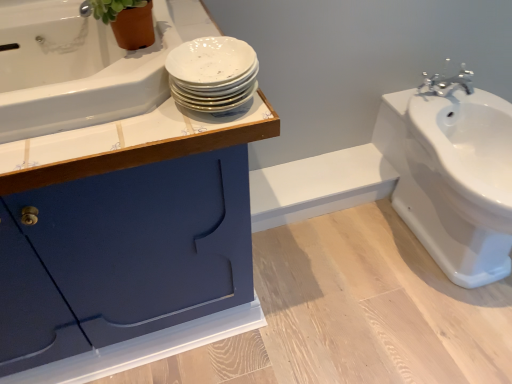
What is the approximate width of matte blue cabinet at upper left?

It is 56.89 centimeters.

This screenshot has width=512, height=384. Describe the element at coordinates (75, 70) in the screenshot. I see `white glossy bathtub at upper left` at that location.

The image size is (512, 384). I want to click on white glossy sink at right, so click(x=452, y=173).

The image size is (512, 384). What do you see at coordinates (213, 74) in the screenshot? I see `white glossy plates at upper center` at bounding box center [213, 74].

In order to face white glossy plates at upper center, should I rotate leftwards or rightwards?

Rotate your view left by about 5.677°.

The height and width of the screenshot is (384, 512). Find the location of `green matte plant at upper left`. green matte plant at upper left is located at coordinates (109, 8).

Which of these two, white glossy bathtub at upper left or white glossy sink at right, is bigger?

Bigger between the two is white glossy sink at right.

Considering the sizes of objects white glossy bathtub at upper left and white glossy sink at right in the image provided, who is wider, white glossy bathtub at upper left or white glossy sink at right?

white glossy sink at right.

Which is behind, point (32, 67) or point (440, 223)?

Point (440, 223)

Which is in front, point (178, 101) or point (384, 110)?

Positioned in front is point (178, 101).

Is white glossy plates at upper center smaller than white glossy sink at right?

Correct, white glossy plates at upper center occupies less space than white glossy sink at right.

Are white glossy plates at upper center and white glossy sink at right far apart?

No, white glossy plates at upper center is in close proximity to white glossy sink at right.

Is white glossy plates at upper center closer to camera compared to white glossy sink at right?

Yes.

From a real-world perspective, is white glossy bathtub at upper left above or below green matte plant at upper left?

white glossy bathtub at upper left is below green matte plant at upper left.

Consider the image. How many degrees apart are the facing directions of white glossy bathtub at upper left and green matte plant at upper left?

35.7 degrees.

Considering the sizes of objects white glossy bathtub at upper left and green matte plant at upper left in the image provided, who is thinner, white glossy bathtub at upper left or green matte plant at upper left?

green matte plant at upper left.

Is matte blue cabinet at upper left aimed at green matte plant at upper left?

No, matte blue cabinet at upper left is not turned towards green matte plant at upper left.

From a real-world perspective, which is physically above, matte blue cabinet at upper left or green matte plant at upper left?

green matte plant at upper left.

Is matte blue cabinet at upper left positioned in front of green matte plant at upper left?

Yes, it is in front of green matte plant at upper left.

Identify the location of bathroom cabinet below the green matte plant at upper left (from the image's perspective). Image resolution: width=512 pixels, height=384 pixels. (126, 242).

Which of these two, white glossy sink at right or green matte plant at upper left, stands taller?

white glossy sink at right is taller.

From the image's perspective, which object appears higher, white glossy sink at right or green matte plant at upper left?

green matte plant at upper left appears higher in the image.

Is white glossy sink at right positioned beyond the bounds of green matte plant at upper left?

Absolutely, white glossy sink at right is external to green matte plant at upper left.

In the scene shown: Does white glossy sink at right appear on the left side of green matte plant at upper left?

In fact, white glossy sink at right is to the right of green matte plant at upper left.

Does green matte plant at upper left have a lesser height compared to white glossy plates at upper center?

In fact, green matte plant at upper left may be taller than white glossy plates at upper center.

Can you tell me how much green matte plant at upper left and white glossy plates at upper center differ in facing direction?

They differ by 34.5 degrees in their facing directions.

Based on the photo, would you say green matte plant at upper left contains white glossy plates at upper center?

No, white glossy plates at upper center is not inside green matte plant at upper left.

Identify the location of plant on the left of the white glossy plates at upper center. The image size is (512, 384). (109, 8).

Identify the location of bathroom cabinet below the white glossy bathtub at upper left (from the image's perspective). (126, 242).

Is white glossy bathtub at upper left placed right next to matte blue cabinet at upper left?

No.

From a real-world perspective, which object stands above the other?

In real-world perspective, white glossy bathtub at upper left is above.

You are a GUI agent. You are given a task and a screenshot of the screen. Output one action in this format:
    pyautogui.click(x=<x>, y=<y>)
    Task: Click on the sink below the white glossy bathtub at upper left (from a real-world perspective)
    The height and width of the screenshot is (384, 512).
    Given the screenshot: What is the action you would take?
    pyautogui.click(x=452, y=173)

I want to click on porcelain above the white glossy sink at right (from a real-world perspective), so click(213, 74).

Looking at the image, which one is located closer to white glossy plates at upper center, white glossy bathtub at upper left or white glossy sink at right?

white glossy bathtub at upper left.

From the image, which object appears to be nearer to green matte plant at upper left, white glossy plates at upper center or white glossy bathtub at upper left?

Among the two, white glossy bathtub at upper left is located nearer to green matte plant at upper left.

From the image, which object appears to be farther from matte blue cabinet at upper left, white glossy plates at upper center or green matte plant at upper left?

green matte plant at upper left lies further to matte blue cabinet at upper left than the other object.

Considering their positions, is matte blue cabinet at upper left positioned further to white glossy plates at upper center than white glossy bathtub at upper left?

matte blue cabinet at upper left is positioned further to the anchor white glossy plates at upper center.

When comparing their distances from white glossy bathtub at upper left, does green matte plant at upper left or matte blue cabinet at upper left seem further?

matte blue cabinet at upper left.

From the image, which object appears to be nearer to green matte plant at upper left, white glossy bathtub at upper left or white glossy plates at upper center?

Among the two, white glossy bathtub at upper left is located nearer to green matte plant at upper left.

Which object lies nearer to the anchor point white glossy plates at upper center, white glossy sink at right or matte blue cabinet at upper left?

matte blue cabinet at upper left is closer to white glossy plates at upper center.

Looking at the image, which one is located closer to white glossy plates at upper center, matte blue cabinet at upper left or white glossy sink at right?

matte blue cabinet at upper left is positioned closer to the anchor white glossy plates at upper center.

Identify the location of bath between green matte plant at upper left and matte blue cabinet at upper left in the vertical direction. Image resolution: width=512 pixels, height=384 pixels. 75,70.

Locate an element on the screen. The height and width of the screenshot is (384, 512). porcelain between green matte plant at upper left and matte blue cabinet at upper left in the up-down direction is located at coordinates (213, 74).

In order to click on porcelain between green matte plant at upper left and white glossy sink at right from left to right in this screenshot , I will do [x=213, y=74].

Identify the location of plant situated between white glossy bathtub at upper left and white glossy sink at right from left to right. (109, 8).